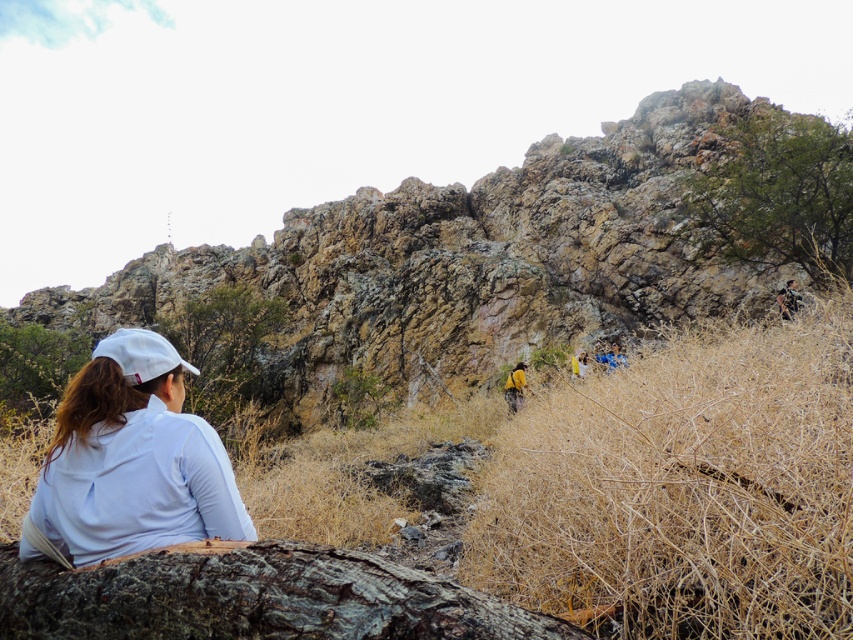
The width and height of the screenshot is (853, 640). Identify the location of rugged rock formation at upper center. (466, 259).

Is rugged rock formation at upper center thinner than white matte shirt at lower left?

Incorrect, rugged rock formation at upper center's width is not less than white matte shirt at lower left's.

Locate an element on the screen. rugged rock formation at upper center is located at coordinates pos(466,259).

Can you confirm if rugged rock formation at upper center is bigger than blue fabric at center?

Indeed, rugged rock formation at upper center has a larger size compared to blue fabric at center.

Who is lower down, rugged rock formation at upper center or blue fabric at center?

Positioned lower is blue fabric at center.

Is point (469, 204) closer to viewer compared to point (598, 358)?

No.

The width and height of the screenshot is (853, 640). I want to click on rugged rock formation at upper center, so click(x=466, y=259).

Does rugged rock formation at upper center appear on the right side of dark brown rough bark at lower center?

In fact, rugged rock formation at upper center is to the left of dark brown rough bark at lower center.

This screenshot has width=853, height=640. I want to click on rugged rock formation at upper center, so click(466, 259).

Is point (155, 252) less distant than point (474, 634)?

That is False.

The width and height of the screenshot is (853, 640). What are the coordinates of `rugged rock formation at upper center` in the screenshot? It's located at (466, 259).